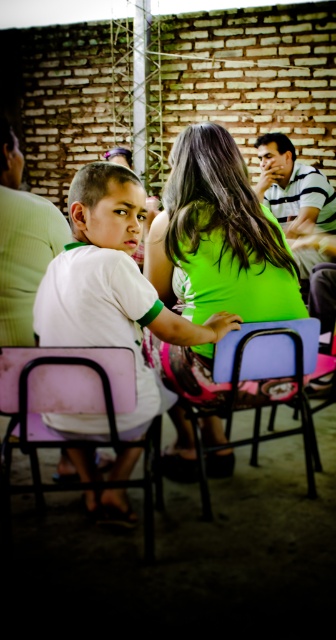
Question: Which point appears closest to the camera in this image?

Choices:
 (A) (284, 198)
 (B) (122, 378)
 (C) (259, 289)

Answer: (B)

Question: Which point appears farthest from the camera in this image?

Choices:
 (A) (0, 227)
 (B) (97, 252)
 (C) (288, 275)
 (D) (112, 403)

Answer: (A)

Question: Does pink matte chair at lower left have a greater width compared to blue plastic chair at center?

Choices:
 (A) no
 (B) yes

Answer: (A)

Question: Is green matte shirt at center to the right of pink matte chair at lower left from the viewer's perspective?

Choices:
 (A) no
 (B) yes

Answer: (B)

Question: Estimate the real-world distances between objects in this image. Which object is closer to the blue plastic chair at center?

Choices:
 (A) green matte shirt at center
 (B) pink matte chair at lower left
 (C) white matte shirt at center
 (D) striped shirt at center

Answer: (A)

Question: From the image, what is the correct spatial relationship of green matte shirt at center in relation to blue plastic chair at center?

Choices:
 (A) right
 (B) left

Answer: (B)